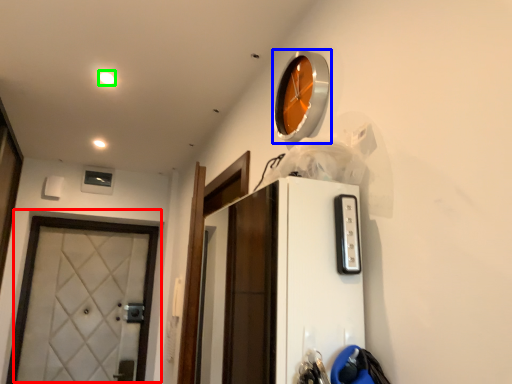
Question: Considering the real-world distances, which object is closest to door (highlighted by a red box)? clock (highlighted by a blue box) or light (highlighted by a green box).

Choices:
 (A) clock
 (B) light

Answer: (B)